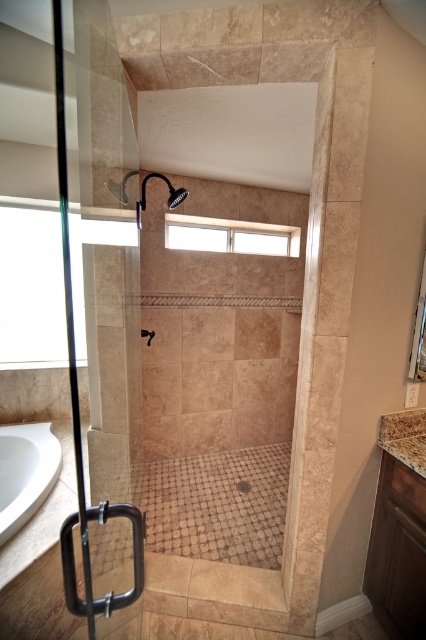
Which of these two, transparent glass door at left or marble countertop at lower right, stands taller?

With more height is transparent glass door at left.

Measure the distance between transparent glass door at left and marble countertop at lower right.

A distance of 1.16 meters exists between transparent glass door at left and marble countertop at lower right.

Does point (48, 134) come farther from viewer compared to point (400, 433)?

Yes.

You are a GUI agent. You are given a task and a screenshot of the screen. Output one action in this format:
    pyautogui.click(x=<x>, y=<y>)
    Task: Click on the transparent glass door at left
    
    Given the screenshot: What is the action you would take?
    pyautogui.click(x=101, y=250)

Looking at this image, is transparent glass door at left taller than white glossy bathtub at lower left?

Yes, transparent glass door at left is taller than white glossy bathtub at lower left.

Identify the location of transparent glass door at left. (101, 250).

In the scene shown: Between clear glass window at upper center and matte black shower head at upper center, which one appears on the left side from the viewer's perspective?

Positioned to the left is matte black shower head at upper center.

Between clear glass window at upper center and matte black shower head at upper center, which one is positioned lower?

clear glass window at upper center is lower down.

Is point (265, 230) in front of point (147, 179)?

No, it is not.

Identify the location of clear glass window at upper center. (230, 236).